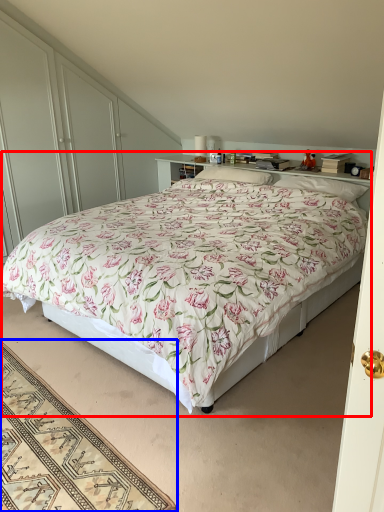
Question: Which object appears closest to the camera in this image, bed (highlighted by a red box) or mat (highlighted by a blue box)?

Choices:
 (A) bed
 (B) mat

Answer: (B)